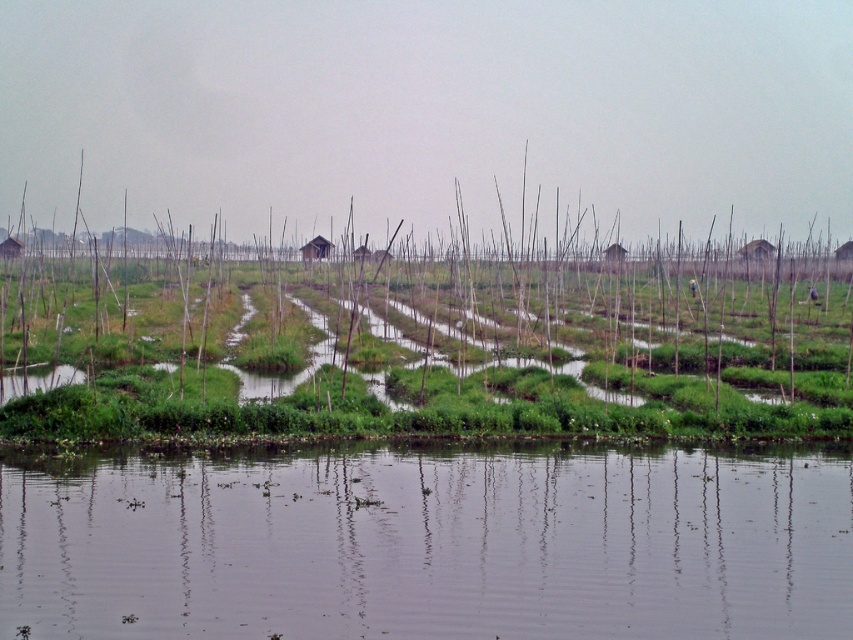
You are standing at the edge of the paddy field and see the clear water at lower center and the green grassy reed at center. Which object is positioned to the right of the other?

The clear water at lower center is to the right of the green grassy reed at center.

You are standing at the edge of the paddy field and want to walk towards the green grassy reed at center. Which direction should you move relative to the clear water at lower center?

You should move upwards relative to the clear water at lower center to reach the green grassy reed at center, since the clear water at lower center is located below the green grassy reed at center.